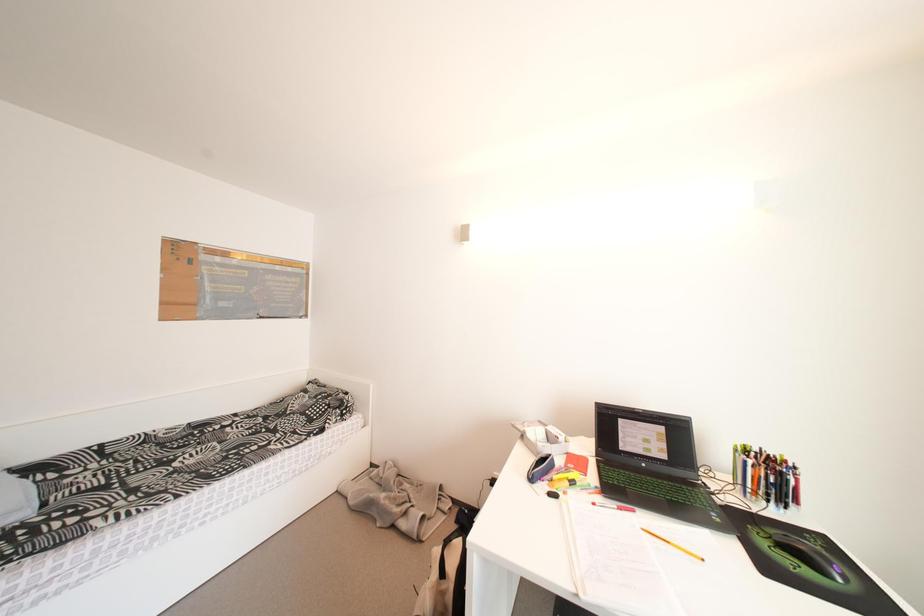
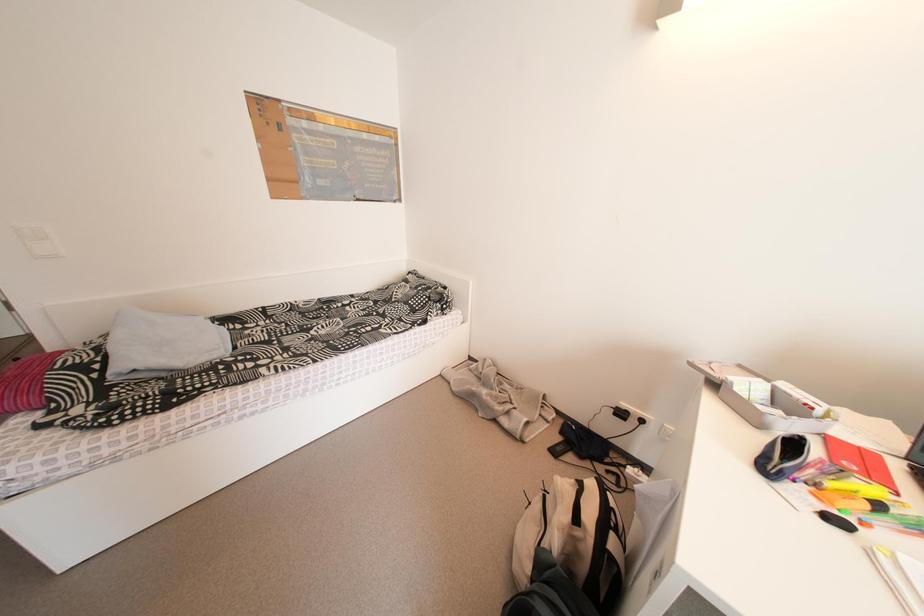
The images are taken continuously from a first-person perspective. In which direction is your viewpoint rotating?

The rotation direction of the camera is left-down.